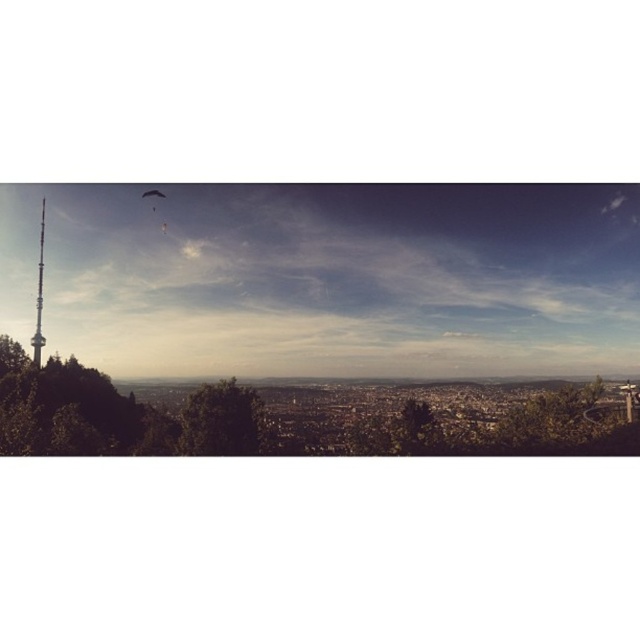
You are an urban planner assessing the cityscape. You need to determine if the green leafy tree at left will block the view of the smooth silver spire at left from the main road. Based on their widths, can you determine if the tree is wider than the spire?

The green leafy tree at left is wider than the smooth silver spire at left, so it may block the view of the spire from the main road depending on their positions.

You are standing at the base of the green leafy tree at left. You want to take a photo of the tower that is 2000 feet away. Can you capture the entire tower in your camera frame without moving? Explain why or why not.

The distance between you and the camera is 2160.22 feet, which is greater than 2000 feet. Therefore, you cannot capture the entire tower in your camera frame without moving closer.